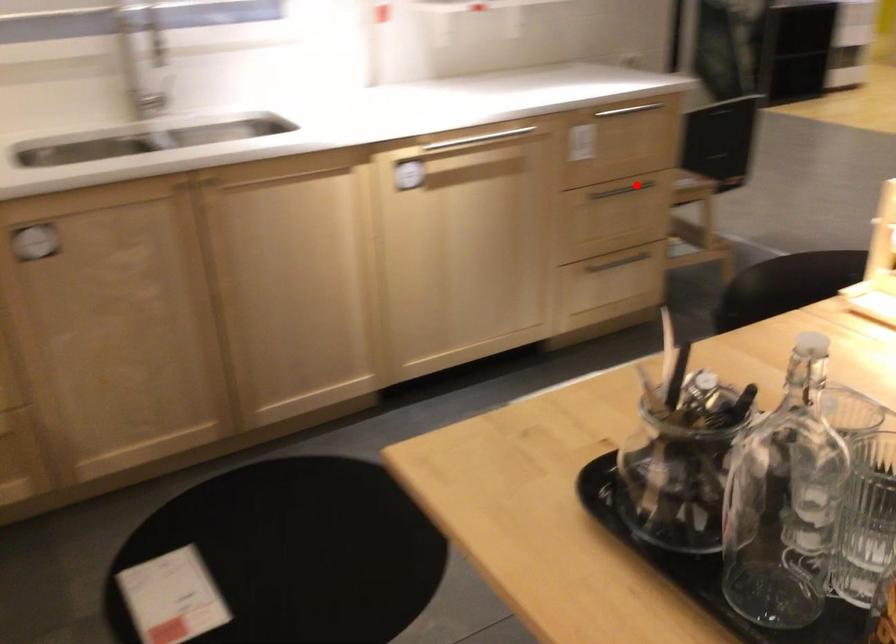
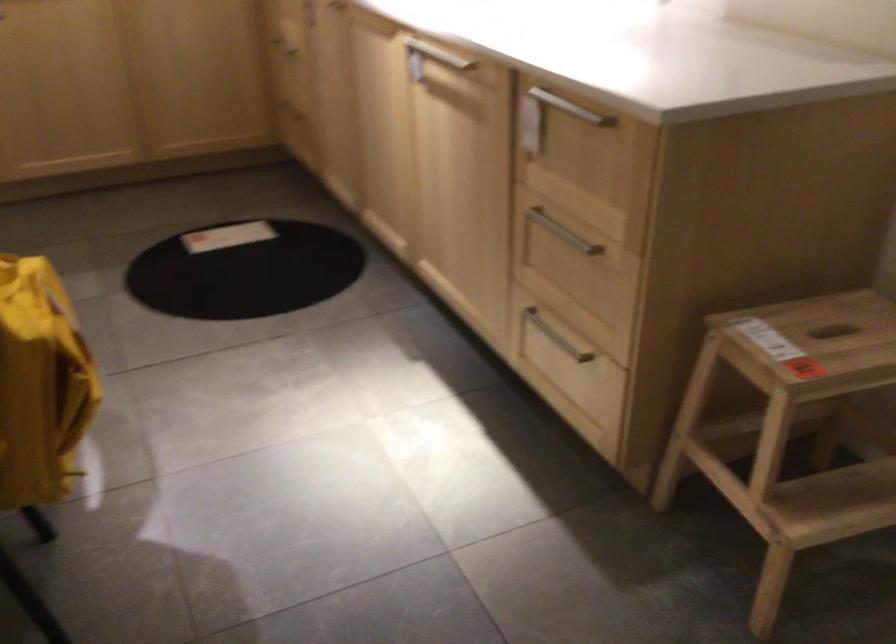
Find the pixel in the second image that matches the highlighted location in the first image.

(563, 232)